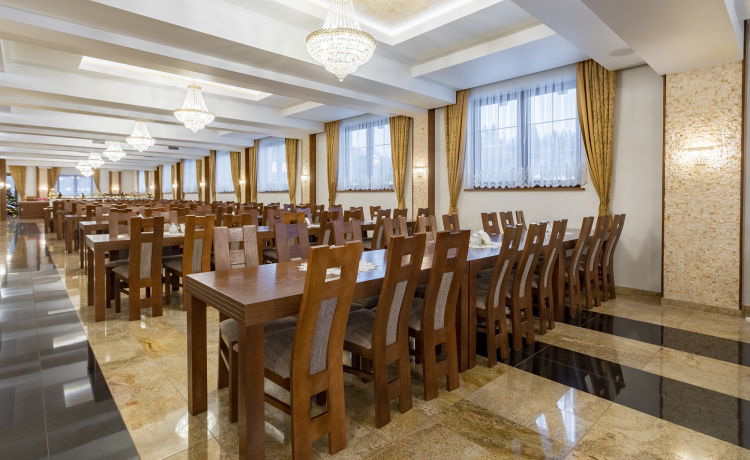
Identify the location of chandelier. This screenshot has width=750, height=460. (358, 62), (190, 104), (141, 142), (118, 151), (93, 168), (85, 167), (85, 177).